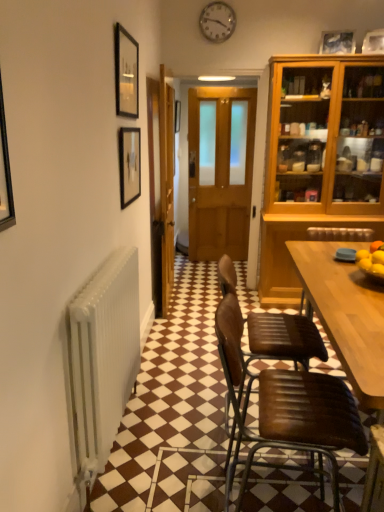
Identify the location of matte black picture frame at upper left, which is the second picture frame from front to back. This screenshot has width=384, height=512. (129, 165).

Measure the distance between brown leather chair at center, which is the 1th chair in back-to-front order, and camera.

brown leather chair at center, which is the 1th chair in back-to-front order, and camera are 5.93 feet apart.

Describe the element at coordinates (101, 359) in the screenshot. The image size is (384, 512). I see `white metallic radiator at left` at that location.

Describe the element at coordinates (161, 187) in the screenshot. I see `wooden door at center, arranged as the first door when viewed from the left` at that location.

At what (x,y) coordinates should I click in order to perform the action: click on wooden door at center, the 1th door from the right. Please return your answer as a coordinate pair (x, y). Looking at the image, I should click on (220, 170).

Visually, is wooden door at center, positioned as the second door in right-to-left order, positioned to the left or to the right of wooden door at center, the 1th door from the right?

From the image, it's evident that wooden door at center, positioned as the second door in right-to-left order, is to the left of wooden door at center, the 1th door from the right.

Considering the sizes of objects wooden door at center, arranged as the first door when viewed from the left, and wooden door at center, the 1th door from the right, in the image provided, who is taller, wooden door at center, arranged as the first door when viewed from the left, or wooden door at center, the 1th door from the right,?

wooden door at center, the 1th door from the right, is taller.

From the image's perspective, is wooden door at center, arranged as the first door when viewed from the left, on top of wooden door at center, the 1th door from the right?

No, from the image's perspective, wooden door at center, arranged as the first door when viewed from the left, is not on top of wooden door at center, the 1th door from the right.

In the scene shown: Which is in front, matte black picture frame at upper left, positioned as the second picture frame in right-to-left order, or wooden door at center, positioned as the second door in right-to-left order?

matte black picture frame at upper left, positioned as the second picture frame in right-to-left order, is closer to the camera.

Which of these two, matte black picture frame at upper left, marked as the 1th picture frame in a front-to-back arrangement, or wooden door at center, arranged as the first door when viewed from the left, is thinner?

matte black picture frame at upper left, marked as the 1th picture frame in a front-to-back arrangement.

Is matte black picture frame at upper left, marked as the 1th picture frame in a front-to-back arrangement, bigger than wooden door at center, arranged as the first door when viewed from the left?

No.

Are matte black picture frame at upper left, arranged as the 2th picture frame when ordered from the bottom, and wooden door at center, arranged as the first door when viewed from the left, located far from each other?

No, there isn't a large distance between matte black picture frame at upper left, arranged as the 2th picture frame when ordered from the bottom, and wooden door at center, arranged as the first door when viewed from the left.

Starting from the white metallic radiator at left, which picture frame is the 3rd one behind? Please provide its 2D coordinates.

[(337, 42)]

Is matte black picture frame at upper right, which ranks as the 1th picture frame in right-to-left order, far from white metallic radiator at left?

matte black picture frame at upper right, which ranks as the 1th picture frame in right-to-left order, is far away from white metallic radiator at left.

In terms of height, does matte black picture frame at upper right, which ranks as the 1th picture frame in right-to-left order, look taller or shorter compared to white metallic radiator at left?

matte black picture frame at upper right, which ranks as the 1th picture frame in right-to-left order, is taller than white metallic radiator at left.

Is matte black picture frame at upper right, placed as the third picture frame when sorted from bottom to top, touching brown leather chair at center, positioned as the 2th chair in front-to-back order?

matte black picture frame at upper right, placed as the third picture frame when sorted from bottom to top, and brown leather chair at center, positioned as the 2th chair in front-to-back order, are clearly separated.

Between matte black picture frame at upper right, placed as the third picture frame when sorted from bottom to top, and brown leather chair at center, positioned as the 2th chair in front-to-back order, which one has more height?

With more height is brown leather chair at center, positioned as the 2th chair in front-to-back order.

Considering the sizes of matte black picture frame at upper right, placed as the 1th picture frame when sorted from back to front, and brown leather chair at center, positioned as the 2th chair in front-to-back order, in the image, is matte black picture frame at upper right, placed as the 1th picture frame when sorted from back to front, wider or thinner than brown leather chair at center, positioned as the 2th chair in front-to-back order,?

Clearly, matte black picture frame at upper right, placed as the 1th picture frame when sorted from back to front, has less width compared to brown leather chair at center, positioned as the 2th chair in front-to-back order.

Is white metallic radiator at left situated inside brown leather chair at center, which is the 1th chair in back-to-front order, or outside?

white metallic radiator at left is spatially situated outside brown leather chair at center, which is the 1th chair in back-to-front order.

Is white metallic radiator at left oriented away from brown leather chair at center, which is the 1th chair in back-to-front order?

No, brown leather chair at center, which is the 1th chair in back-to-front order, is not at the back of white metallic radiator at left.

Based on the photo, from a real-world perspective, is white metallic radiator at left positioned above or below brown leather chair at center, which is the 1th chair in back-to-front order?

white metallic radiator at left is situated lower than brown leather chair at center, which is the 1th chair in back-to-front order, in the real world.

Could you tell me if brown leather chair at lower right is facing brown leather chair at center, which is the 1th chair in back-to-front order?

→ No, brown leather chair at lower right is not turned towards brown leather chair at center, which is the 1th chair in back-to-front order.

Does brown leather chair at lower right touch brown leather chair at center, positioned as the 2th chair in front-to-back order?

No, brown leather chair at lower right is not with brown leather chair at center, positioned as the 2th chair in front-to-back order.

Considering the relative sizes of brown leather chair at lower right and brown leather chair at center, which is the 1th chair in back-to-front order, in the image provided, is brown leather chair at lower right wider than brown leather chair at center, which is the 1th chair in back-to-front order,?

Yes, brown leather chair at lower right is wider than brown leather chair at center, which is the 1th chair in back-to-front order.

Looking at this image, from the image's perspective, which one is positioned higher, brown leather chair at lower right or brown leather chair at center, which is the 1th chair in back-to-front order?

brown leather chair at center, which is the 1th chair in back-to-front order, appears higher in the image.

Does point (139, 175) lie in front of point (262, 327)?

That is False.

I want to click on chair that is the 1st object located below the matte black picture frame at upper left, which ranks as the first picture frame in left-to-right order (from the image's perspective), so click(284, 338).

Is matte black picture frame at upper left, which ranks as the first picture frame in left-to-right order, beside brown leather chair at center, which is the 1th chair in back-to-front order?

matte black picture frame at upper left, which ranks as the first picture frame in left-to-right order, and brown leather chair at center, which is the 1th chair in back-to-front order, are not in contact.

Does matte black picture frame at upper left, which is the first picture frame from bottom to top, lie behind brown leather chair at center, which is the 1th chair in back-to-front order?

That is True.

What are the coordinates of `door on the right side of wooden door at center, arranged as the first door when viewed from the left` in the screenshot? It's located at (220, 170).

From the image's perspective, count 2nd picture frames upward from the wooden door at center, arranged as the first door when viewed from the left, and point to it. Please provide its 2D coordinates.

[(126, 73)]

Looking at the image, which one is located further to wooden door at center, the 1th door from the right, metallic clock at upper center or brown leather chair at lower right?

brown leather chair at lower right lies further to wooden door at center, the 1th door from the right, than the other object.

Estimate the real-world distances between objects in this image. Which object is closer to brown leather chair at lower right, metallic clock at upper center or matte black picture frame at upper left, arranged as the third picture frame when viewed from the back?

matte black picture frame at upper left, arranged as the third picture frame when viewed from the back, is positioned closer to the anchor brown leather chair at lower right.

When comparing their distances from matte black picture frame at upper left, the 2th picture frame when ordered from top to bottom, does wooden door at center, positioned as the second door in right-to-left order, or brown leather chair at lower right, acting as the first chair starting from the front, seem further?

The object further to matte black picture frame at upper left, the 2th picture frame when ordered from top to bottom, is brown leather chair at lower right, acting as the first chair starting from the front.

Estimate the real-world distances between objects in this image. Which object is closer to brown leather chair at lower right, matte black picture frame at upper left, which is the second picture frame from front to back, or white metallic radiator at left?

The object closer to brown leather chair at lower right is white metallic radiator at left.

From the image, which object appears to be nearer to brown leather chair at lower right, metallic clock at upper center or matte black picture frame at upper left, which is the first picture frame from bottom to top?

matte black picture frame at upper left, which is the first picture frame from bottom to top.

From the image, which object appears to be farther from matte black picture frame at upper left, positioned as the second picture frame in right-to-left order, matte black picture frame at upper right, placed as the 1th picture frame when sorted from back to front, or brown leather chair at lower right?

The object further to matte black picture frame at upper left, positioned as the second picture frame in right-to-left order, is brown leather chair at lower right.

From the image, which object appears to be farther from matte black picture frame at upper left, arranged as the 2th picture frame when ordered from the bottom, wooden door at center, which is the second door from left to right, or brown leather chair at lower right, acting as the first chair starting from the front?

wooden door at center, which is the second door from left to right, lies further to matte black picture frame at upper left, arranged as the 2th picture frame when ordered from the bottom, than the other object.

Based on their spatial positions, is brown leather chair at lower right, the second chair viewed from the back, or matte black picture frame at upper right, which ranks as the 1th picture frame in right-to-left order, closer to metallic clock at upper center?

matte black picture frame at upper right, which ranks as the 1th picture frame in right-to-left order, is closer to metallic clock at upper center.

You are a GUI agent. You are given a task and a screenshot of the screen. Output one action in this format:
    pyautogui.click(x=<x>, y=<y>)
    Task: Click on the chair between matte black picture frame at upper right, placed as the 1th picture frame when sorted from back to front, and brown leather chair at lower right, the second chair viewed from the back, in the up-down direction
    
    Given the screenshot: What is the action you would take?
    pyautogui.click(x=284, y=338)

I want to click on clock located between matte black picture frame at upper left, which is the second picture frame from front to back, and matte black picture frame at upper right, placed as the third picture frame when sorted from bottom to top, in the left-right direction, so click(x=217, y=22).

At what (x,y) coordinates should I click in order to perform the action: click on chair between brown leather chair at lower right and wooden door at center, which is the second door from left to right, from front to back. Please return your answer as a coordinate pair (x, y). Looking at the image, I should click on (284, 338).

What are the coordinates of `chair between brown leather chair at lower right and wooden door at center, positioned as the second door in right-to-left order, from front to back` in the screenshot? It's located at (284, 338).